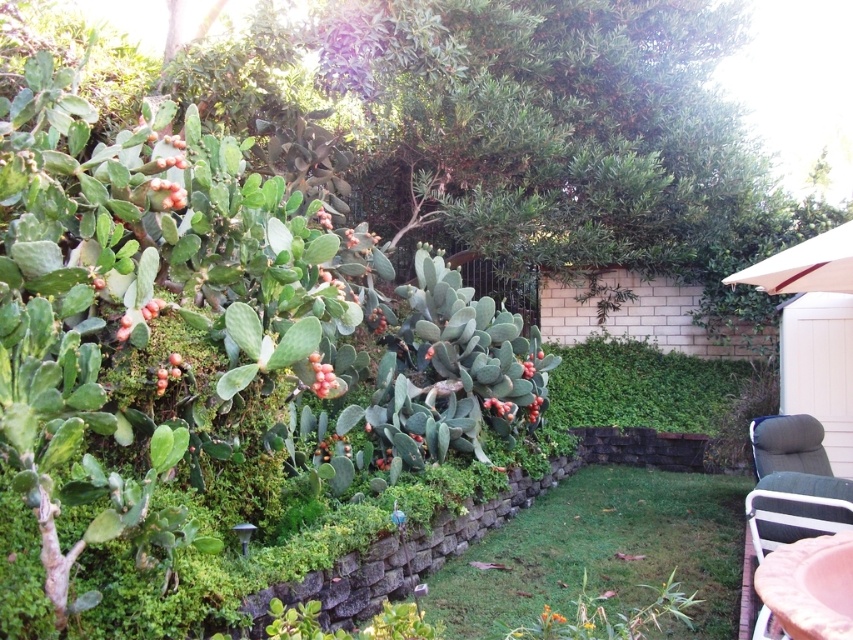
Which is below, green grass at center or pink fabric chair at lower right?

green grass at center is below.

Who is more distant from viewer, (x=689, y=568) or (x=810, y=420)?

Positioned behind is point (x=810, y=420).

You are a GUI agent. You are given a task and a screenshot of the screen. Output one action in this format:
    pyautogui.click(x=<x>, y=<y>)
    Task: Click on the green grass at center
    The image size is (853, 640).
    Given the screenshot: What is the action you would take?
    pyautogui.click(x=602, y=552)

Is green grass at center shorter than gray fabric chair at lower right?

Correct, green grass at center is not as tall as gray fabric chair at lower right.

Who is taller, green grass at center or gray fabric chair at lower right?

gray fabric chair at lower right

I want to click on green grass at center, so click(602, 552).

Locate an element on the screen. This screenshot has height=640, width=853. green grass at center is located at coordinates (602, 552).

Which of these two, pink fabric chair at lower right or gray fabric chair at lower right, stands taller?

With more height is gray fabric chair at lower right.

Can you confirm if pink fabric chair at lower right is wider than gray fabric chair at lower right?

No, pink fabric chair at lower right is not wider than gray fabric chair at lower right.

Is point (834, 486) farther from viewer compared to point (787, 420)?

No.

You are a GUI agent. You are given a task and a screenshot of the screen. Output one action in this format:
    pyautogui.click(x=<x>, y=<y>)
    Task: Click on the pink fabric chair at lower right
    The image size is (853, 640).
    Given the screenshot: What is the action you would take?
    pyautogui.click(x=792, y=483)